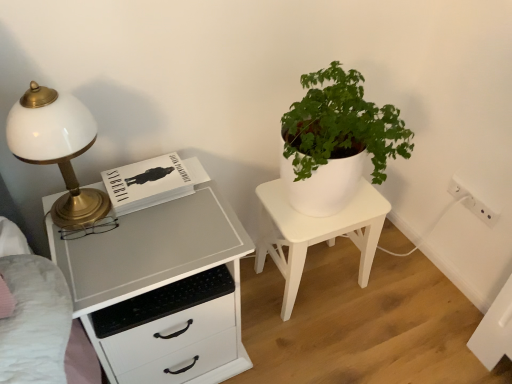
Question: Is white matte/porcelain nightstand at center completely or partially inside white glossy chest of drawers at left?

Choices:
 (A) no
 (B) yes

Answer: (A)

Question: Does white glossy chest of drawers at left have a smaller size compared to white matte/porcelain nightstand at center?

Choices:
 (A) no
 (B) yes

Answer: (A)

Question: Is white glossy chest of drawers at left to the right of white matte/porcelain nightstand at center from the viewer's perspective?

Choices:
 (A) no
 (B) yes

Answer: (A)

Question: Is white glossy chest of drawers at left positioned in front of white matte/porcelain nightstand at center?

Choices:
 (A) yes
 (B) no

Answer: (A)

Question: Is white glossy chest of drawers at left taller than white matte/porcelain nightstand at center?

Choices:
 (A) no
 (B) yes

Answer: (B)

Question: Does white glossy chest of drawers at left appear on the left side of white matte/porcelain nightstand at center?

Choices:
 (A) yes
 (B) no

Answer: (A)

Question: Does white matte/porcelain nightstand at center have a smaller size compared to white plastic electric outlet at lower right?

Choices:
 (A) no
 (B) yes

Answer: (A)

Question: Is white plastic electric outlet at lower right surrounded by white matte/porcelain nightstand at center?

Choices:
 (A) yes
 (B) no

Answer: (B)

Question: From the image's perspective, is white matte/porcelain nightstand at center located above white plastic electric outlet at lower right?

Choices:
 (A) no
 (B) yes

Answer: (A)

Question: Does white matte/porcelain nightstand at center turn towards white plastic electric outlet at lower right?

Choices:
 (A) yes
 (B) no

Answer: (B)

Question: Is white matte/porcelain nightstand at center turned away from white plastic electric outlet at lower right?

Choices:
 (A) no
 (B) yes

Answer: (A)

Question: From a real-world perspective, is white matte/porcelain nightstand at center below white plastic electric outlet at lower right?

Choices:
 (A) yes
 (B) no

Answer: (A)

Question: Is white glossy chest of drawers at left looking in the opposite direction of white glossy lamp at left?

Choices:
 (A) no
 (B) yes

Answer: (A)